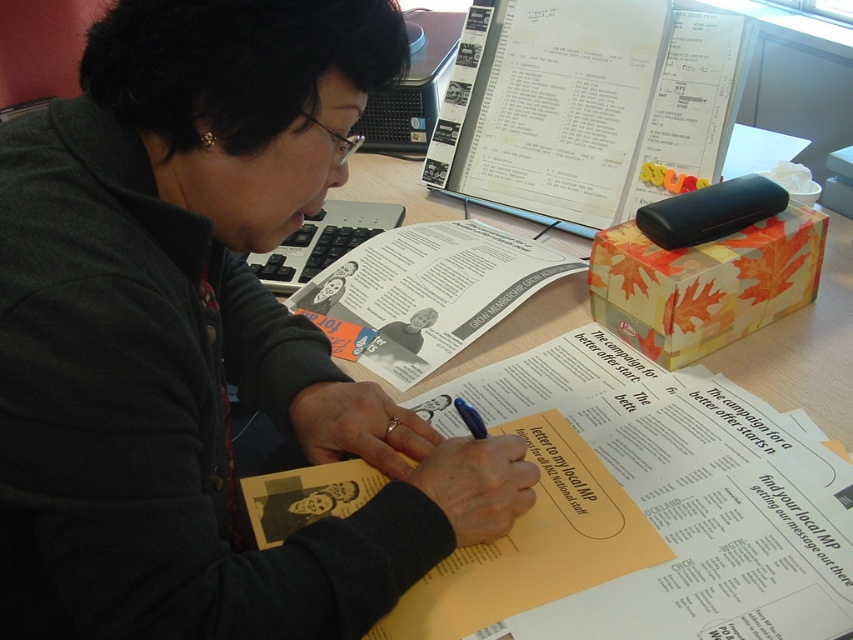
You are organizing the desk items. You need to place a new red folder between the black plastic computer at upper center and the blue plastic pen at center. Can you do this without moving the computer or the pen?

The black plastic computer at upper center is positioned on the left side of blue plastic pen at center, so there is space between them to place the new red folder without moving either object.

You are standing in a room and see the wooden table at center. If you want to place a new document on the table, where exactly should you put it?

The wooden table at center is located at point (480,317), so you should place the new document there.